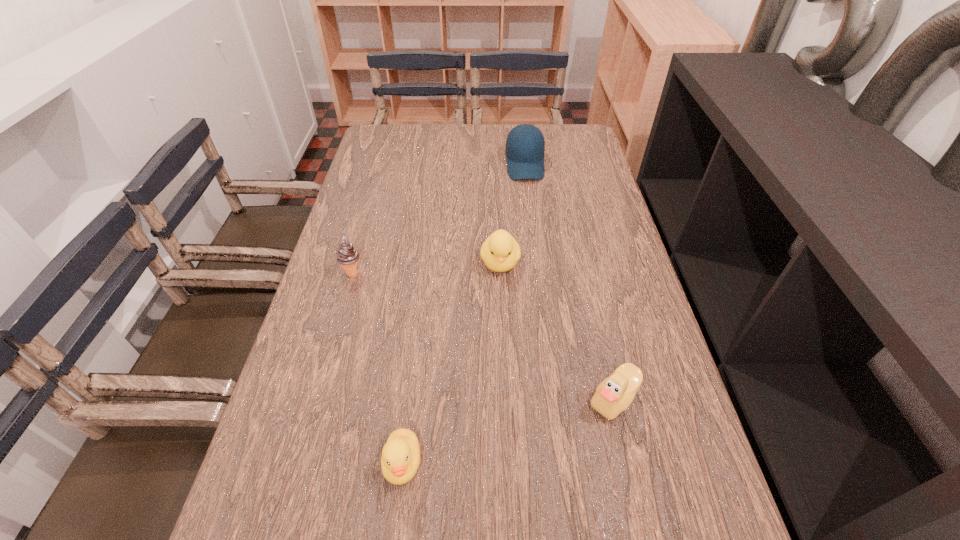
Where is `free location located 0.360m at the beak of the rightmost duck`? The width and height of the screenshot is (960, 540). free location located 0.360m at the beak of the rightmost duck is located at coordinates (411, 399).

This screenshot has height=540, width=960. Find the location of `blank space located 0.230m at the beak of the rightmost duck`. blank space located 0.230m at the beak of the rightmost duck is located at coordinates (475, 399).

At what (x,y) coordinates should I click in order to perform the action: click on vacant region located 0.270m at the beak of the rightmost duck. Please return your answer as a coordinate pair (x, y). Image resolution: width=960 pixels, height=540 pixels. Looking at the image, I should click on (455, 399).

Locate an element on the screen. free space located 0.060m at the beak of the nearest duck is located at coordinates (395, 530).

Locate an element on the screen. The width and height of the screenshot is (960, 540). object at the far edge is located at coordinates pos(525,146).

Image resolution: width=960 pixels, height=540 pixels. I want to click on object located at the left edge, so click(x=347, y=255).

Image resolution: width=960 pixels, height=540 pixels. I want to click on object that is positioned at the right edge, so click(x=613, y=395).

Locate an element on the screen. vacant space at the far edge is located at coordinates [x=501, y=127].

The height and width of the screenshot is (540, 960). I want to click on free space at the left edge of the desktop, so click(343, 236).

The image size is (960, 540). Find the location of `vacant space at the right edge`. vacant space at the right edge is located at coordinates (585, 176).